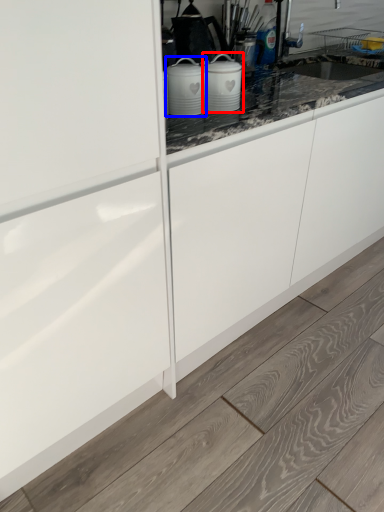
Question: Which object is closer to the camera taking this photo, kitchen appliance (highlighted by a red box) or home appliance (highlighted by a blue box)?

Choices:
 (A) kitchen appliance
 (B) home appliance

Answer: (B)